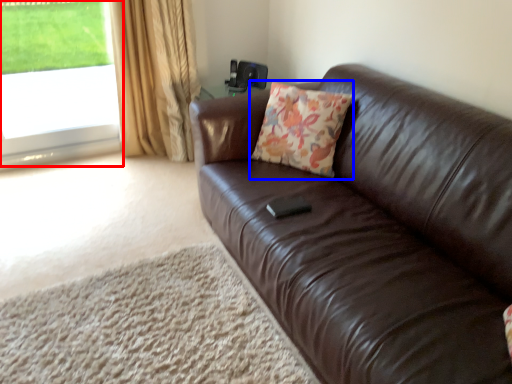
Question: Which of the following is the farthest to the observer, window (highlighted by a red box) or throw pillow (highlighted by a blue box)?

Choices:
 (A) window
 (B) throw pillow

Answer: (A)